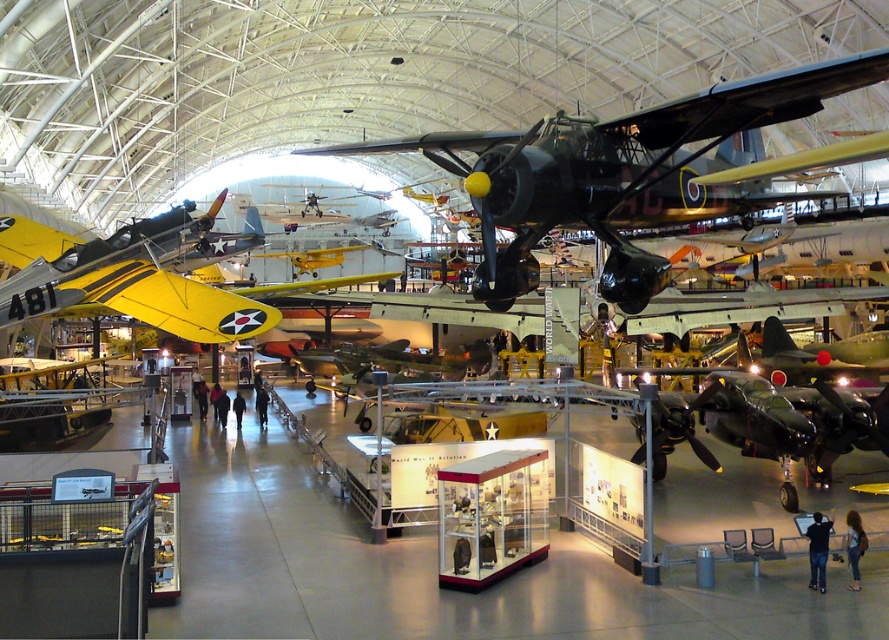
You are a museum visitor standing in the center of the aviation museum. You see the shiny black airplane at center and the yellow matte airplane at left. Which airplane is lower in height?

The shiny black airplane at center has a lesser height compared to the yellow matte airplane at left, so the shiny black airplane at center is lower in height.

You are a museum guide who needs to lead a group to the shiny black airplane at center. The group is currently standing 10 meters away from it. Can they reach the airplane without moving closer than the minimum distance required?

The shiny black airplane at center is 10.11 meters away, so the group is currently 10 meters away, which is within the minimum distance requirement. They can proceed to the airplane as they are already close enough.